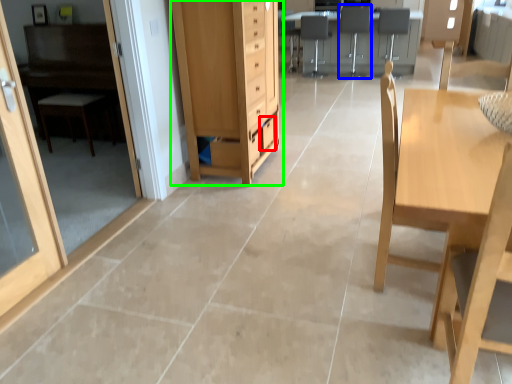
Question: Considering the real-world distances, which object is closest to drawer (highlighted by a red box)? armchair (highlighted by a blue box) or cabinetry (highlighted by a green box).

Choices:
 (A) armchair
 (B) cabinetry

Answer: (B)